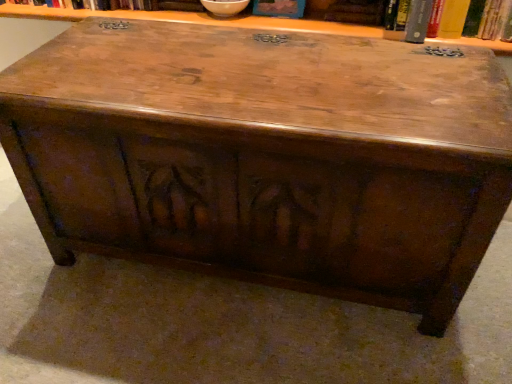
Question: Can you confirm if hardcover book at upper right, arranged as the second book when viewed from the left, is taller than blue cardboard book at upper center, which is the first book in left-to-right order?

Choices:
 (A) no
 (B) yes

Answer: (B)

Question: From a real-world perspective, is hardcover book at upper right, arranged as the second book when viewed from the left, positioned under blue cardboard book at upper center, which is the first book in left-to-right order, based on gravity?

Choices:
 (A) yes
 (B) no

Answer: (B)

Question: Is hardcover book at upper right, the first book viewed from the right, positioned behind blue cardboard book at upper center, which is the 2th book in right-to-left order?

Choices:
 (A) no
 (B) yes

Answer: (A)

Question: Would you consider hardcover book at upper right, the first book viewed from the right, to be distant from blue cardboard book at upper center, which is the 2th book in right-to-left order?

Choices:
 (A) no
 (B) yes

Answer: (A)

Question: Does hardcover book at upper right, the first book viewed from the right, have a smaller size compared to blue cardboard book at upper center, which is the 2th book in right-to-left order?

Choices:
 (A) yes
 (B) no

Answer: (B)

Question: Can you confirm if hardcover book at upper right, the first book viewed from the right, is shorter than blue cardboard book at upper center, which is the 2th book in right-to-left order?

Choices:
 (A) yes
 (B) no

Answer: (B)

Question: From a real-world perspective, does blue cardboard book at upper center, which is the 2th book in right-to-left order, sit lower than hardcover book at upper right, arranged as the second book when viewed from the left?

Choices:
 (A) yes
 (B) no

Answer: (A)

Question: From the image's perspective, is blue cardboard book at upper center, which is the 2th book in right-to-left order, located above hardcover book at upper right, arranged as the second book when viewed from the left?

Choices:
 (A) no
 (B) yes

Answer: (B)

Question: Is blue cardboard book at upper center, which is the 2th book in right-to-left order, facing towards hardcover book at upper right, the first book viewed from the right?

Choices:
 (A) yes
 (B) no

Answer: (B)

Question: Does blue cardboard book at upper center, which is the first book in left-to-right order, appear on the left side of hardcover book at upper right, arranged as the second book when viewed from the left?

Choices:
 (A) yes
 (B) no

Answer: (A)

Question: Is blue cardboard book at upper center, which is the first book in left-to-right order, oriented away from hardcover book at upper right, the first book viewed from the right?

Choices:
 (A) yes
 (B) no

Answer: (B)

Question: Is blue cardboard book at upper center, which is the first book in left-to-right order, thinner than hardcover book at upper right, arranged as the second book when viewed from the left?

Choices:
 (A) yes
 (B) no

Answer: (A)

Question: From the image's perspective, relative to blue cardboard book at upper center, which is the first book in left-to-right order, is hardcover book at upper right, the first book viewed from the right, above or below?

Choices:
 (A) above
 (B) below

Answer: (B)